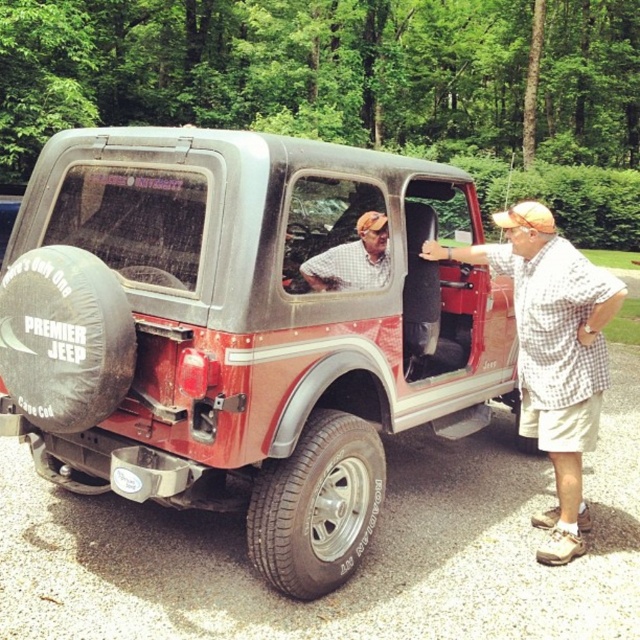
Question: Which object is the closest to the checkered fabric shirt at center?

Choices:
 (A) rustic metal pickup truck at center
 (B) checkered fabric shirt at right
 (C) black rubber tire at lower center

Answer: (A)

Question: Which object is farther from the camera taking this photo?

Choices:
 (A) black rubber tire at lower center
 (B) checkered fabric shirt at right

Answer: (B)

Question: Among these objects, which one is farthest from the camera?

Choices:
 (A) black rubber tire at lower center
 (B) checkered fabric shirt at center
 (C) checkered fabric shirt at right
 (D) rustic metal pickup truck at center

Answer: (C)

Question: Does black rubber tire at lower center lie in front of checkered fabric shirt at center?

Choices:
 (A) yes
 (B) no

Answer: (A)

Question: Does black rubber tire at lower center appear under checkered fabric shirt at center?

Choices:
 (A) no
 (B) yes

Answer: (B)

Question: Does rustic metal pickup truck at center have a smaller size compared to black rubber tire at lower center?

Choices:
 (A) yes
 (B) no

Answer: (B)